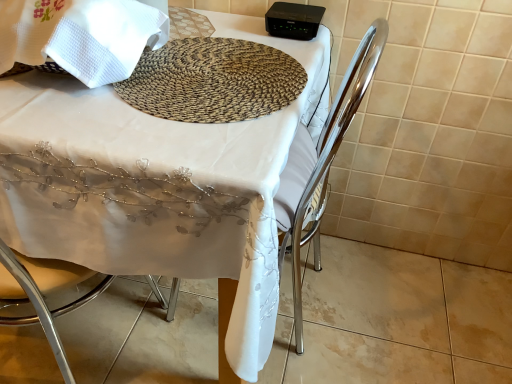
What do you see at coordinates (320, 166) in the screenshot? This screenshot has height=384, width=512. I see `metallic silver chair at center` at bounding box center [320, 166].

The width and height of the screenshot is (512, 384). What are the coordinates of `woven natural fiber mat at center` in the screenshot? It's located at (212, 81).

Looking at their sizes, would you say white fabric table at center is wider or thinner than metallic silver chair at center?

In the image, white fabric table at center appears to be wider than metallic silver chair at center.

Which is behind, point (195, 189) or point (294, 216)?

The point (294, 216) is farther from the camera.

Between white fabric table at center and metallic silver chair at center, which one has larger size?

white fabric table at center is bigger.

Is white fabric table at center next to metallic silver chair at center?

No, white fabric table at center is not beside metallic silver chair at center.

Could you tell me if metallic silver chair at center is turned towards woven natural fiber mat at center?

Yes, metallic silver chair at center is facing woven natural fiber mat at center.

Looking at the image, does metallic silver chair at center seem bigger or smaller compared to woven natural fiber mat at center?

metallic silver chair at center is bigger than woven natural fiber mat at center.

Is point (310, 159) positioned after point (283, 107)?

That is True.

Which of these two, metallic silver chair at center or woven natural fiber mat at center, is thinner?

With smaller width is woven natural fiber mat at center.

Can you confirm if woven natural fiber mat at center is smaller than white fabric table at center?

Indeed, woven natural fiber mat at center has a smaller size compared to white fabric table at center.

Consider the image. Does woven natural fiber mat at center contain white fabric table at center?

Actually, white fabric table at center is outside woven natural fiber mat at center.

Considering the positions of points (186, 119) and (72, 216), is point (186, 119) farther from camera compared to point (72, 216)?

No.

Are woven natural fiber mat at center and white fabric table at center located far from each other?

They are positioned close to each other.

Can you see white fabric table at center touching woven natural fiber mat at center?

white fabric table at center and woven natural fiber mat at center are clearly separated.

Which point is more distant from viewer, (x=8, y=231) or (x=294, y=88)?

The point (x=294, y=88) is more distant.

Between white fabric table at center and woven natural fiber mat at center, which one is positioned behind?

woven natural fiber mat at center is further from the camera.

From the image's perspective, who appears lower, white fabric table at center or woven natural fiber mat at center?

white fabric table at center, from the image's perspective.

Is woven natural fiber mat at center facing away from metallic silver chair at center?

Yes.

Is woven natural fiber mat at center next to metallic silver chair at center and touching it?

woven natural fiber mat at center and metallic silver chair at center are not in contact.

Does woven natural fiber mat at center have a greater width compared to metallic silver chair at center?

No, woven natural fiber mat at center is not wider than metallic silver chair at center.

Looking at this image, can you tell me how much woven natural fiber mat at center and metallic silver chair at center differ in facing direction?

91.6 degrees.

Is metallic silver chair at center looking in the opposite direction of white fabric table at center?

Absolutely, metallic silver chair at center is directed away from white fabric table at center.

Which is more distant, (306, 165) or (51, 237)?

The point (306, 165) is more distant.

Is the surface of metallic silver chair at center in direct contact with white fabric table at center?

No, metallic silver chair at center is not next to white fabric table at center.

Is metallic silver chair at center wider or thinner than white fabric table at center?

Clearly, metallic silver chair at center has less width compared to white fabric table at center.

Locate an element on the screen. chair above the white fabric table at center (from a real-world perspective) is located at coordinates (320, 166).

Image resolution: width=512 pixels, height=384 pixels. In order to click on mat above the metallic silver chair at center (from the image's perspective) in this screenshot , I will do `click(212, 81)`.

Based on their spatial positions, is metallic silver chair at center or white fabric table at center further from woven natural fiber mat at center?

The object further to woven natural fiber mat at center is metallic silver chair at center.

Based on their spatial positions, is white fabric table at center or woven natural fiber mat at center further from metallic silver chair at center?

Based on the image, woven natural fiber mat at center appears to be further to metallic silver chair at center.

Which object lies nearer to the anchor point white fabric table at center, metallic silver chair at center or woven natural fiber mat at center?

Based on the image, woven natural fiber mat at center appears to be nearer to white fabric table at center.

Considering their positions, is woven natural fiber mat at center positioned further to metallic silver chair at center than white fabric table at center?

woven natural fiber mat at center is positioned further to the anchor metallic silver chair at center.

Looking at the image, which one is located further to white fabric table at center, woven natural fiber mat at center or metallic silver chair at center?

Among the two, metallic silver chair at center is located further to white fabric table at center.

Estimate the real-world distances between objects in this image. Which object is further from woven natural fiber mat at center, white fabric table at center or metallic silver chair at center?

Based on the image, metallic silver chair at center appears to be further to woven natural fiber mat at center.

At what (x,y) coordinates should I click in order to perform the action: click on mat situated between white fabric table at center and metallic silver chair at center from left to right. Please return your answer as a coordinate pair (x, y). The height and width of the screenshot is (384, 512). Looking at the image, I should click on (212, 81).